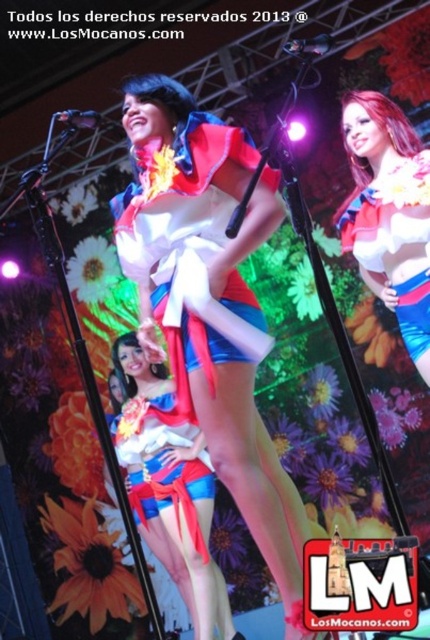
Is shiny satin costume at center shorter than shiny satin skirt at center?

In fact, shiny satin costume at center may be taller than shiny satin skirt at center.

Can you confirm if shiny satin costume at center is positioned to the left of shiny satin skirt at center?

Correct, you'll find shiny satin costume at center to the left of shiny satin skirt at center.

Image resolution: width=430 pixels, height=640 pixels. Describe the element at coordinates (209, 301) in the screenshot. I see `shiny satin costume at center` at that location.

Image resolution: width=430 pixels, height=640 pixels. Identify the location of shiny satin costume at center. (209, 301).

Is point (144, 216) farther from viewer compared to point (57, 120)?

No, (144, 216) is in front of (57, 120).

How far apart are shiny satin dress at center and metallic silver microphone at center?

The distance of shiny satin dress at center from metallic silver microphone at center is 46.18 centimeters.

Is point (199, 250) farther from camera compared to point (79, 120)?

No, it is in front of (79, 120).

I want to click on shiny satin dress at center, so click(x=186, y=225).

Between matte red fabric skirt at center and metallic silver microphone at center, which one is positioned higher?

metallic silver microphone at center is above.

Where is `matte red fabric skirt at center`? The width and height of the screenshot is (430, 640). matte red fabric skirt at center is located at coordinates (163, 465).